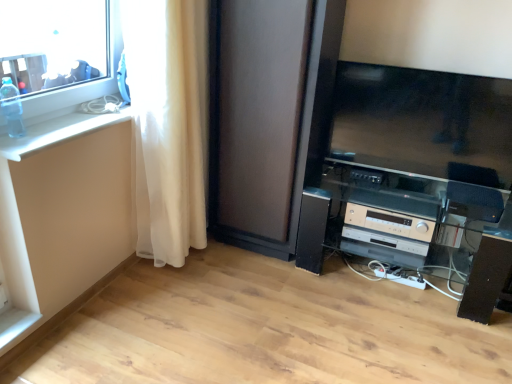
Identify the location of free space between matte black screen door at center and white sheer curtain at left. Image resolution: width=512 pixels, height=384 pixels. (230, 267).